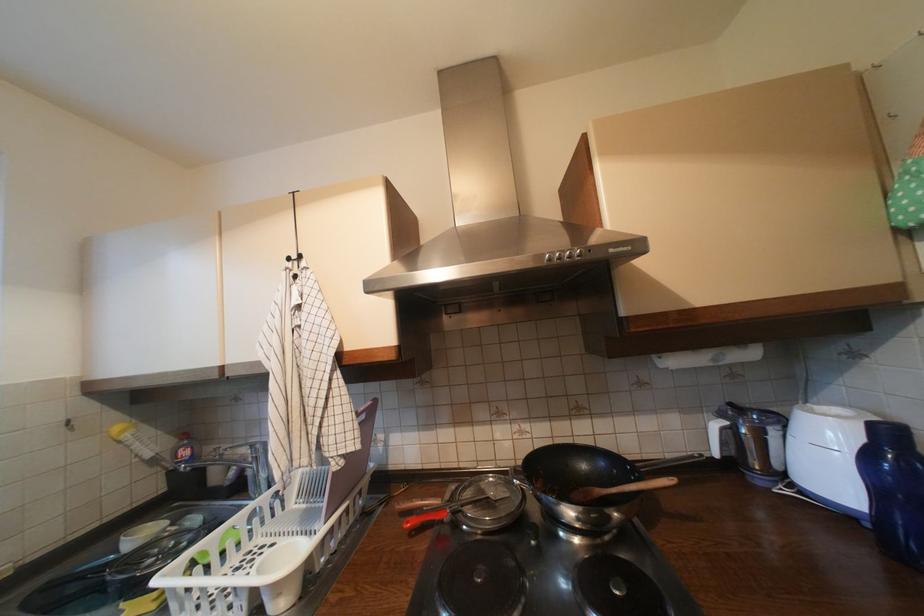
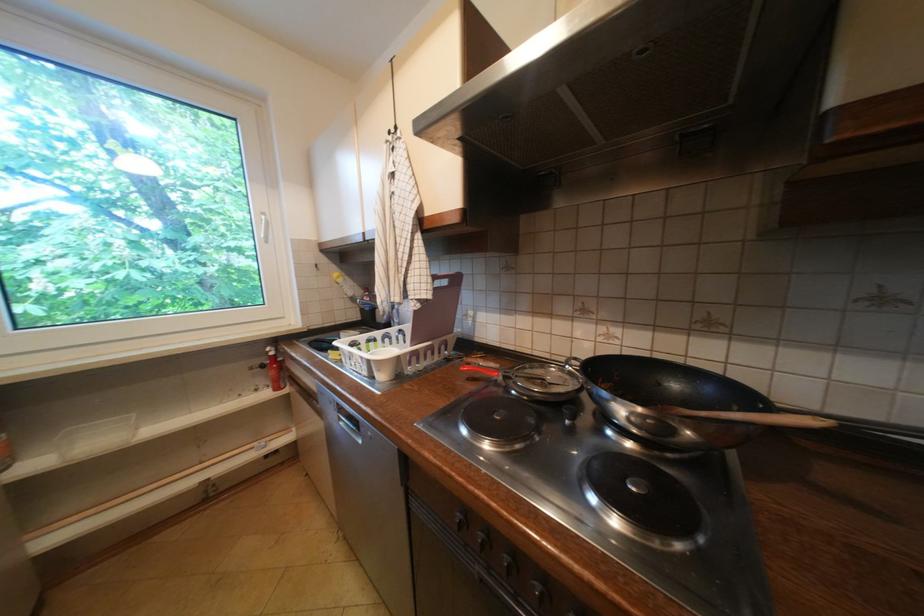
How did the camera likely rotate?

The rotation direction of the camera is left-down.